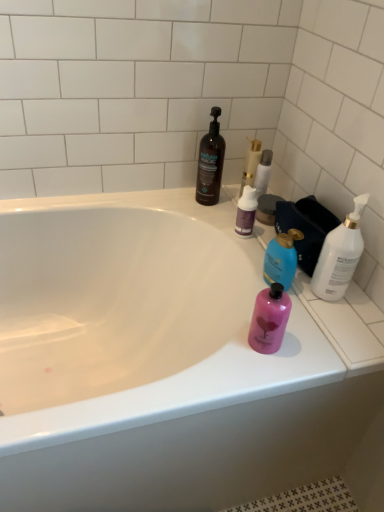
What are the coordinates of `free space in front of blue glossy bottle at upper right, the second bottle in the right-to-left sequence` in the screenshot? It's located at (304, 335).